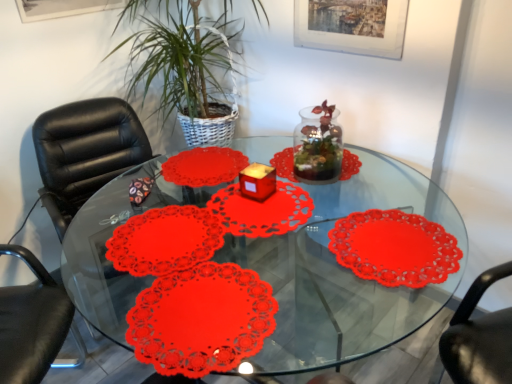
This screenshot has width=512, height=384. Identify the location of free point behind matte red candle holder at center. (255, 177).